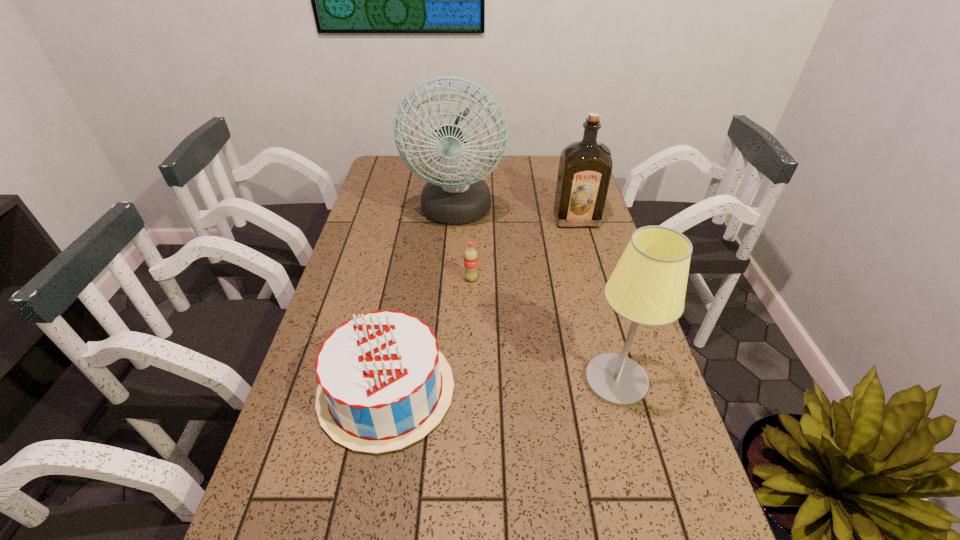
Find the location of a particular element. The height and width of the screenshot is (540, 960). free space between the table lamp and the fan is located at coordinates (536, 296).

Locate an element on the screen. This screenshot has height=540, width=960. vacant area between the table lamp and the liquor is located at coordinates (596, 300).

Where is `free space that is in between the table lamp and the fan`? free space that is in between the table lamp and the fan is located at coordinates (536, 296).

This screenshot has height=540, width=960. I want to click on free space between the second shortest object and the table lamp, so click(x=501, y=386).

Image resolution: width=960 pixels, height=540 pixels. Find the location of `free space between the liquor and the birthday cake`. free space between the liquor and the birthday cake is located at coordinates (481, 305).

Locate an element on the screen. object that is the fourth closest to the tallest object is located at coordinates (648, 286).

The height and width of the screenshot is (540, 960). Find the location of `object that ranks as the third closest to the table lamp`. object that ranks as the third closest to the table lamp is located at coordinates (457, 195).

Find the location of a particular element. This screenshot has height=540, width=960. vacant region that satisfies the following two spatial constraints: 1. in front of the soda where the airflow is directed; 2. on the right side of the tallest object is located at coordinates (451, 279).

Identify the location of free spot that satisfies the following two spatial constraints: 1. in front of the table lamp where the airflow is directed; 2. on the right side of the tallest object. (444, 381).